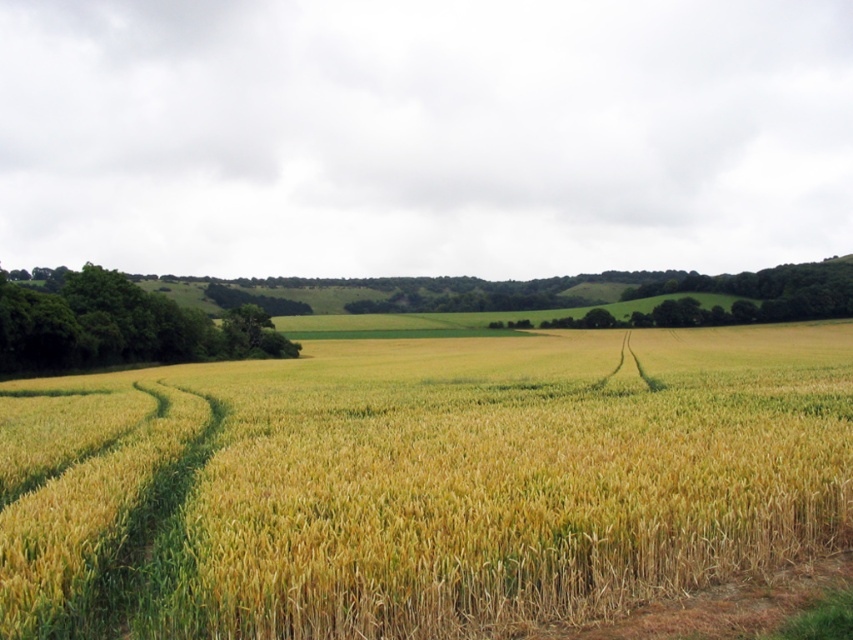
Question: Is yellow grainy wheat field at center smaller than green leafy trees at left?

Choices:
 (A) yes
 (B) no

Answer: (A)

Question: Is yellow grainy wheat field at center thinner than green leafy trees at left?

Choices:
 (A) yes
 (B) no

Answer: (B)

Question: Which point is closer to the camera?

Choices:
 (A) green leafy trees at left
 (B) yellow grainy wheat field at center

Answer: (B)

Question: Among these points, which one is nearest to the camera?

Choices:
 (A) (776, 476)
 (B) (219, 337)

Answer: (A)

Question: Considering the relative positions of yellow grainy wheat field at center and green leafy trees at left in the image provided, where is yellow grainy wheat field at center located with respect to green leafy trees at left?

Choices:
 (A) above
 (B) below

Answer: (B)